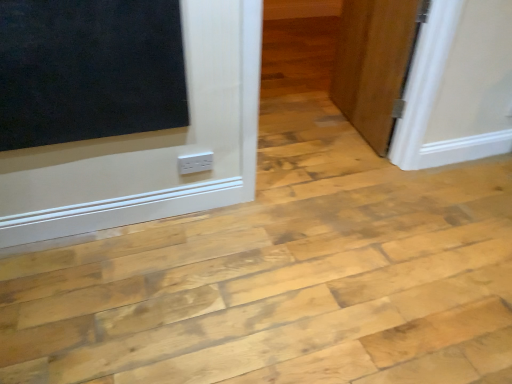
Identify the location of vacant region to the left of wooden door at right. The image size is (512, 384). coord(296,122).